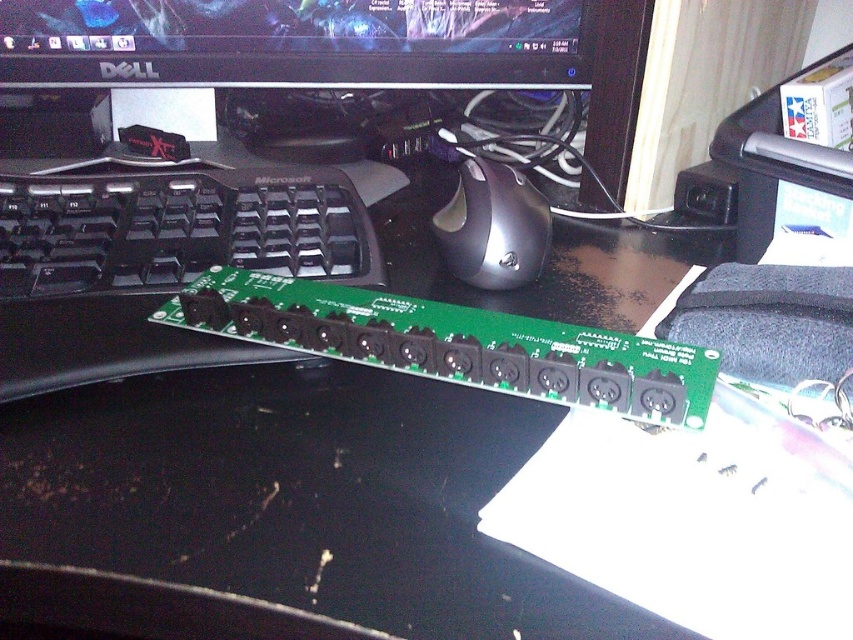
Does black matte keyboard at left appear under black matte mouse at center?

No, black matte keyboard at left is not below black matte mouse at center.

Does black matte keyboard at left appear on the right side of black matte mouse at center?

Incorrect, black matte keyboard at left is not on the right side of black matte mouse at center.

Between point (351, 244) and point (517, 221), which one is positioned behind?

The point (517, 221) is behind.

Where is `black matte keyboard at left`? The height and width of the screenshot is (640, 853). black matte keyboard at left is located at coordinates (178, 228).

Looking at this image, between black glossy monitor at upper center and black matte keyboard at left, which one has less height?

black glossy monitor at upper center

Find the location of a particular element. black glossy monitor at upper center is located at coordinates (294, 42).

Is black glossy monitor at upper center taller than black matte mouse at center?

No.

Is point (201, 60) positioned before point (524, 179)?

No, (201, 60) is behind (524, 179).

Find the location of `black glossy monitor at upper center`. black glossy monitor at upper center is located at coordinates click(294, 42).